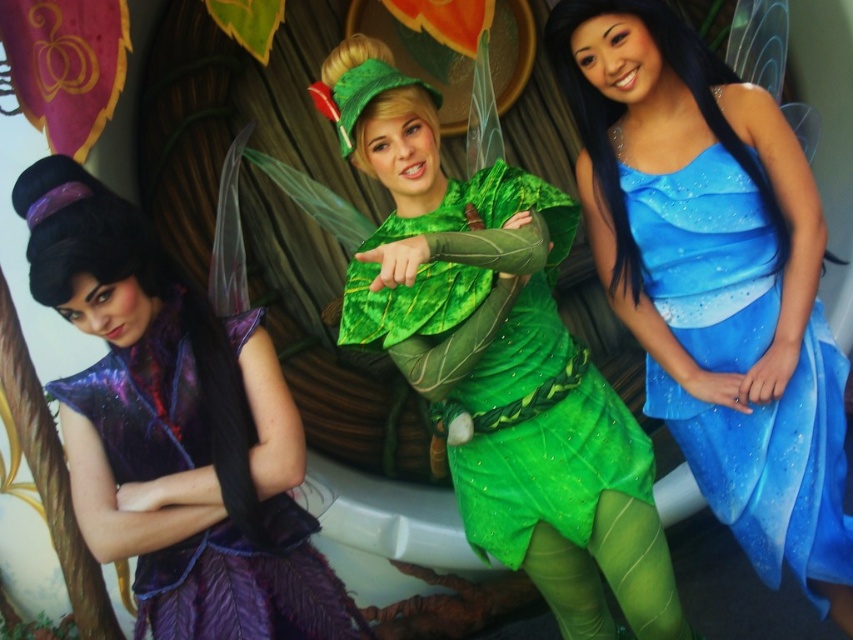
Question: Does blue satin dress at center have a smaller size compared to green leafy costume at center?

Choices:
 (A) yes
 (B) no

Answer: (A)

Question: Among these points, which one is nearest to the camera?

Choices:
 (A) (593, 13)
 (B) (555, 200)
 (C) (152, 353)

Answer: (C)

Question: Among these points, which one is farthest from the camera?

Choices:
 (A) (129, 429)
 (B) (688, 241)
 (C) (442, 352)

Answer: (B)

Question: Does blue satin dress at center appear on the right side of purple satin dress at left?

Choices:
 (A) no
 (B) yes

Answer: (B)

Question: Can you confirm if blue satin dress at center is thinner than purple satin dress at left?

Choices:
 (A) no
 (B) yes

Answer: (B)

Question: Which point is closer to the camera?

Choices:
 (A) purple satin dress at left
 (B) blue satin dress at center

Answer: (A)